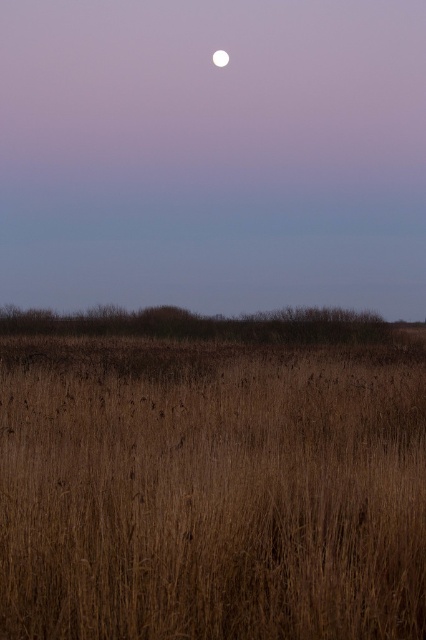
Question: Does brown dry grass at center appear on the left side of white glossy moon at upper center?

Choices:
 (A) yes
 (B) no

Answer: (A)

Question: Among these objects, which one is nearest to the camera?

Choices:
 (A) white glossy moon at upper center
 (B) brown dry grass at center

Answer: (B)

Question: Is brown dry grass at center positioned in front of white glossy moon at upper center?

Choices:
 (A) yes
 (B) no

Answer: (A)

Question: Where is brown dry grass at center located in relation to white glossy moon at upper center in the image?

Choices:
 (A) right
 (B) left

Answer: (B)